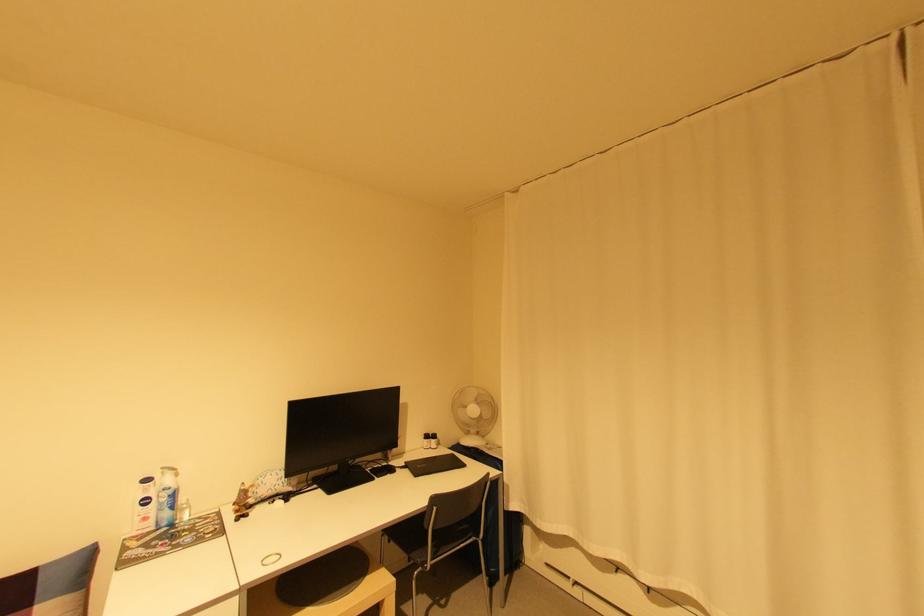
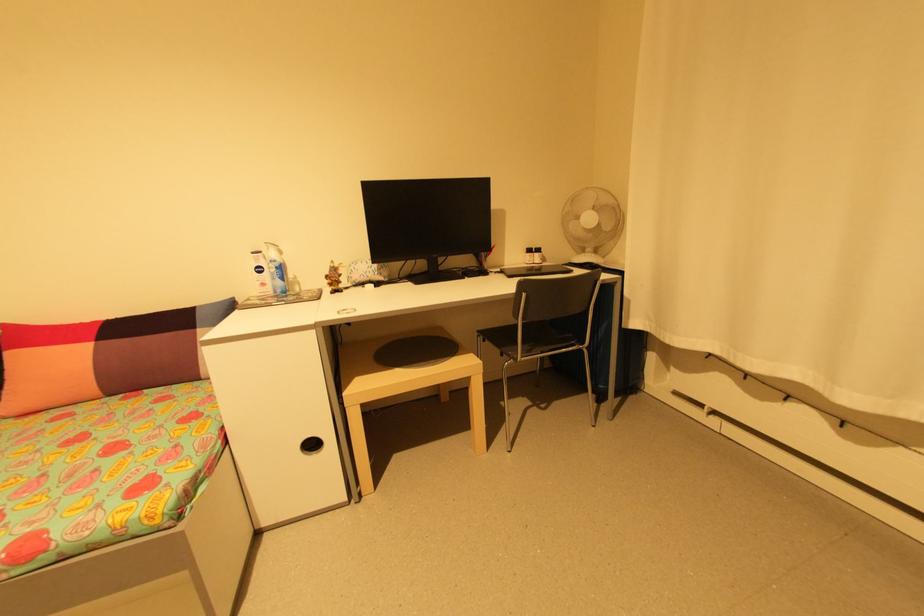
Locate, in the second image, the point that corresponds to (163,524) in the first image.

(280, 291)